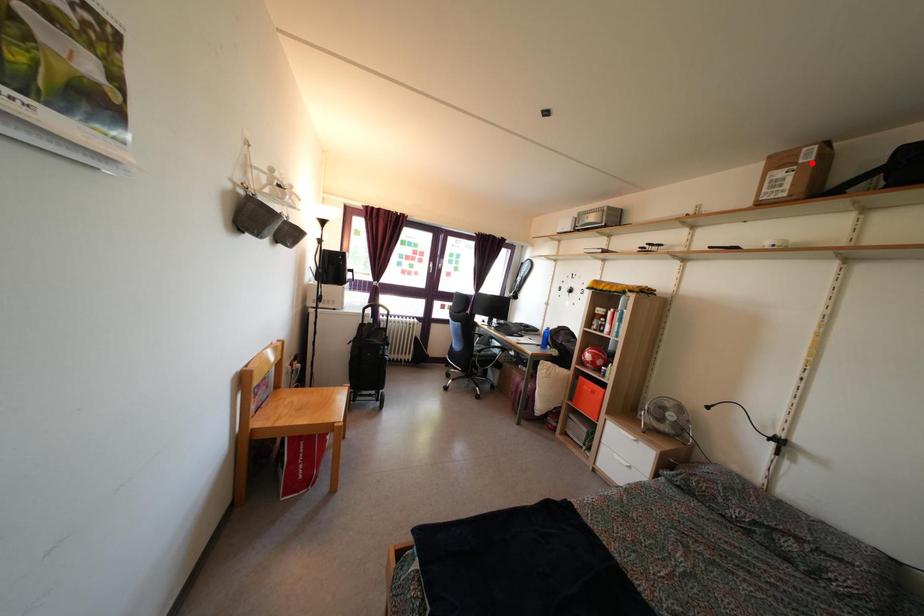
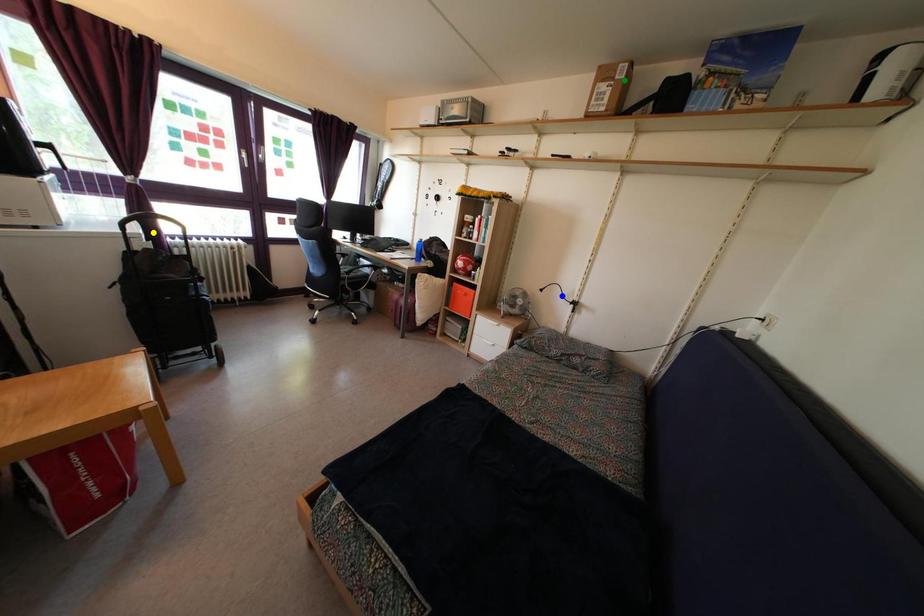
Question: I am providing you with two images of the same scene from different viewpoints. A red point is marked on the first image. You are given multiple points on the second image. Which point in image 2 represents the same 3d spot as the red point in image 1?

Choices:
 (A) yellow point
 (B) blue point
 (C) green point

Answer: (C)